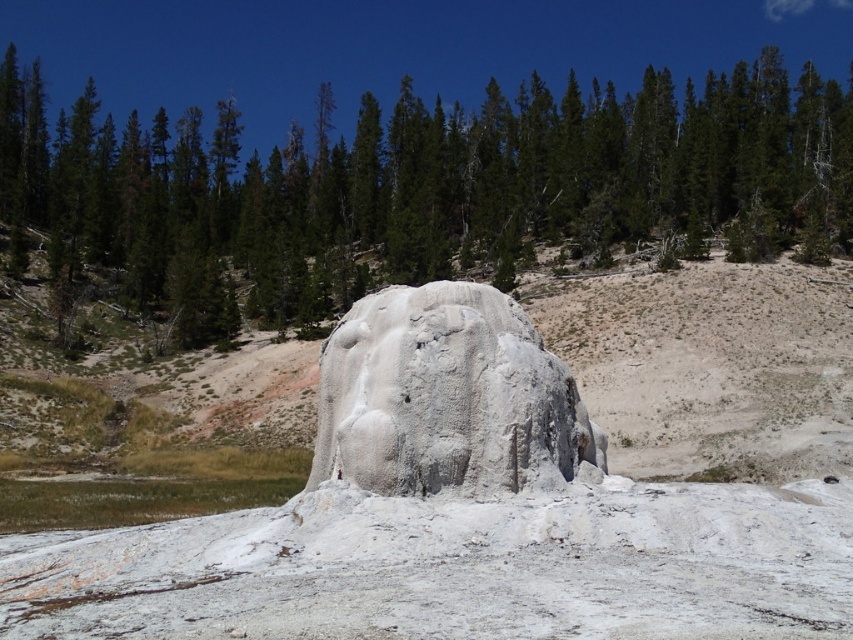
Question: Is green leafy trees at center smaller than white textured rock at center?

Choices:
 (A) yes
 (B) no

Answer: (B)

Question: Can you confirm if green leafy trees at center is bigger than white textured rock at center?

Choices:
 (A) yes
 (B) no

Answer: (A)

Question: Can you confirm if green leafy trees at center is thinner than white textured rock at center?

Choices:
 (A) no
 (B) yes

Answer: (A)

Question: Which of the following is the farthest from the observer?

Choices:
 (A) white textured rock at center
 (B) green leafy trees at center

Answer: (B)